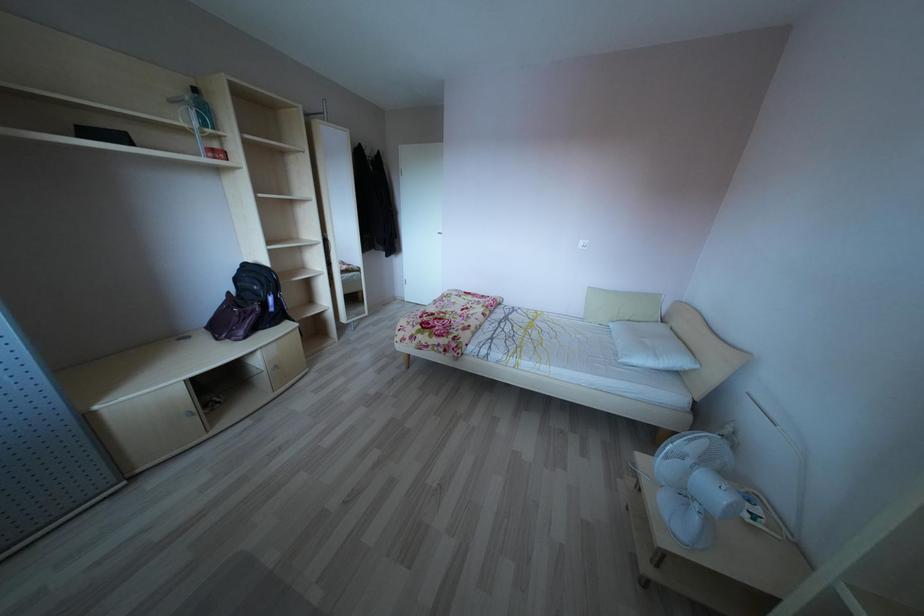
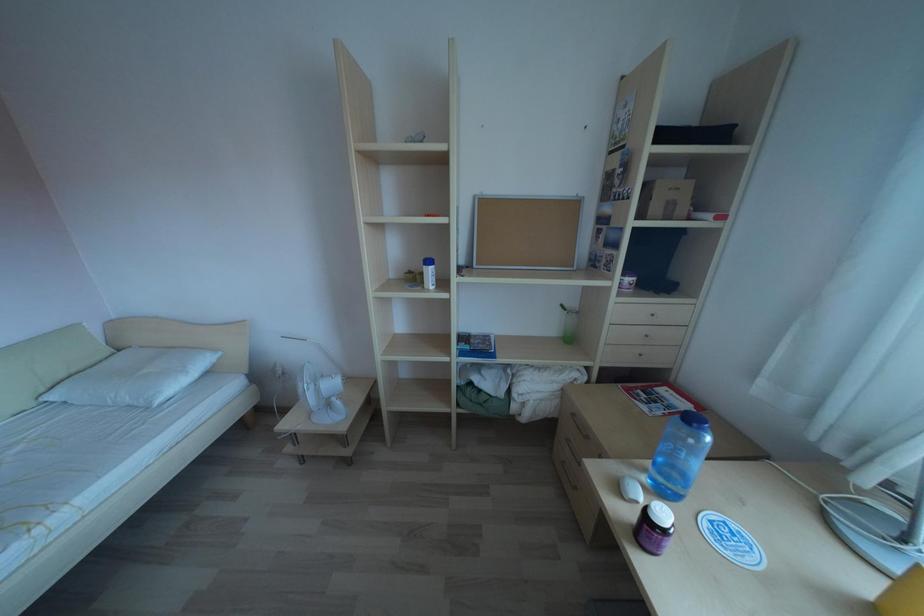
How did the camera likely rotate?

→ The camera rotated toward right-down.